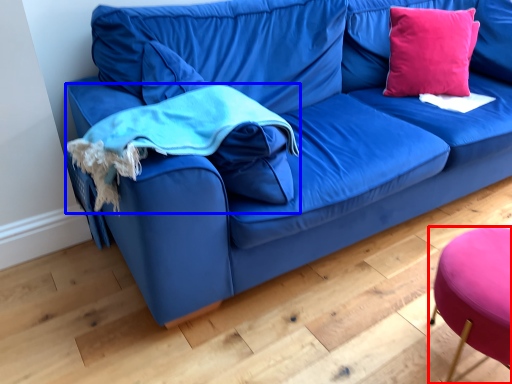
Question: Among these objects, which one is nearest to the camera, stool (highlighted by a red box) or cloth (highlighted by a blue box)?

Choices:
 (A) stool
 (B) cloth

Answer: (A)